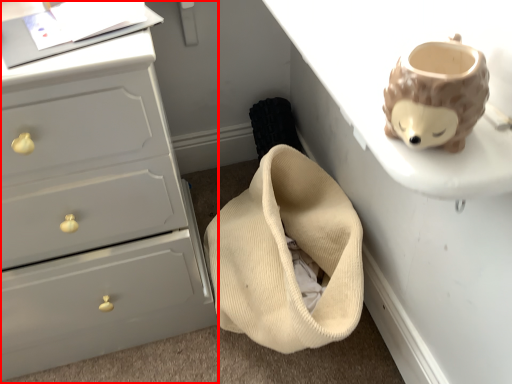
Question: Where is chest of drawers (annotated by the red box) located in relation to table in the image?

Choices:
 (A) right
 (B) left

Answer: (B)